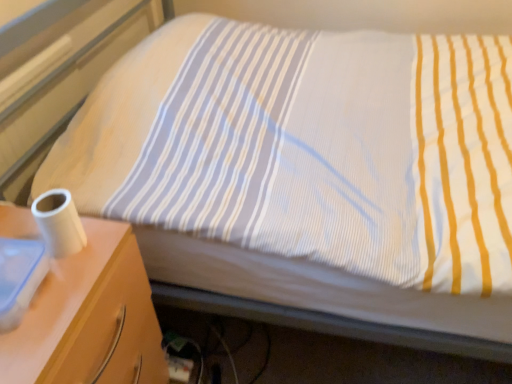
Question: Does point (8, 208) appear closer or farther from the camera than point (35, 213)?

Choices:
 (A) closer
 (B) farther

Answer: (B)

Question: In the image, is white glossy nightstand at left on the left side or the right side of white matte toilet paper at left?

Choices:
 (A) left
 (B) right

Answer: (A)

Question: From the image's perspective, is white glossy nightstand at left positioned above or below white matte toilet paper at left?

Choices:
 (A) below
 (B) above

Answer: (A)

Question: From the image's perspective, is white matte toilet paper at left above or below white glossy nightstand at left?

Choices:
 (A) below
 (B) above

Answer: (B)

Question: Looking at their shapes, would you say white matte toilet paper at left is wider or thinner than white glossy nightstand at left?

Choices:
 (A) wide
 (B) thin

Answer: (B)

Question: Is white matte toilet paper at left taller or shorter than white glossy nightstand at left?

Choices:
 (A) tall
 (B) short

Answer: (B)

Question: Would you say white matte toilet paper at left is inside or outside white glossy nightstand at left?

Choices:
 (A) outside
 (B) inside

Answer: (A)